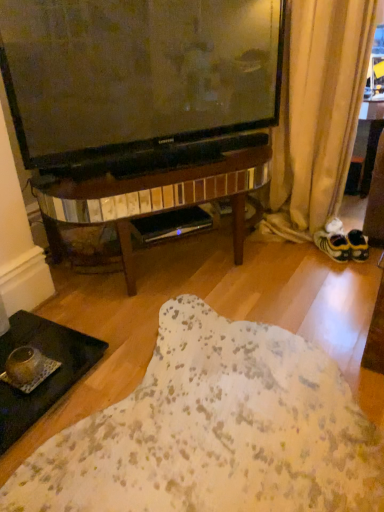
What is the approximate width of beige fabric curtain at lower right?

The width of beige fabric curtain at lower right is 13.13 inches.

Where is `yellow fabric shoe at right`? The image size is (384, 512). yellow fabric shoe at right is located at coordinates (333, 245).

The image size is (384, 512). What are the coordinates of `beige fabric curtain at lower right` in the screenshot? It's located at (317, 113).

Can you confirm if beige fabric curtain at lower right is thinner than black glass tray at lower left?

Indeed, beige fabric curtain at lower right has a lesser width compared to black glass tray at lower left.

Which point is more distant from viewer, (305, 191) or (39, 388)?

The point (305, 191) is farther.

Considering the sizes of beige fabric curtain at lower right and black glass tray at lower left in the image, is beige fabric curtain at lower right bigger or smaller than black glass tray at lower left?

In the image, beige fabric curtain at lower right appears to be larger than black glass tray at lower left.

Is beige fabric curtain at lower right facing away from black glass tray at lower left?

No, black glass tray at lower left is not at the back of beige fabric curtain at lower right.

Does beige fabric curtain at lower right have a larger size compared to yellow fabric shoe at right?

Correct, beige fabric curtain at lower right is larger in size than yellow fabric shoe at right.

Is beige fabric curtain at lower right closer to camera compared to yellow fabric shoe at right?

Yes, beige fabric curtain at lower right is in front of yellow fabric shoe at right.

Is point (318, 39) more distant than point (323, 236)?

No, (318, 39) is in front of (323, 236).

Looking at this image, is beige fabric curtain at lower right at the right side of yellow fabric shoe at right?

In fact, beige fabric curtain at lower right is to the left of yellow fabric shoe at right.

Is black glass tray at lower left located within yellow fabric shoe at right?

No, black glass tray at lower left is not a part of yellow fabric shoe at right.

Is yellow fabric shoe at right in contact with black glass tray at lower left?

They are not placed beside each other.

Between yellow fabric shoe at right and black glass tray at lower left, which one is positioned behind?

yellow fabric shoe at right is further from the camera.

Is the position of black glass tray at lower left more distant than that of beige fabric curtain at lower right?

That is False.

Is black glass tray at lower left outside of beige fabric curtain at lower right?

black glass tray at lower left is positioned outside beige fabric curtain at lower right.

Does black glass tray at lower left touch beige fabric curtain at lower right?

There is a gap between black glass tray at lower left and beige fabric curtain at lower right.

Looking at the image, does black glass tray at lower left seem bigger or smaller compared to beige fabric curtain at lower right?

Considering their sizes, black glass tray at lower left takes up less space than beige fabric curtain at lower right.

Considering the relative positions of black glass tray at lower left and yellow fabric shoe at right in the image provided, is black glass tray at lower left to the left of yellow fabric shoe at right from the viewer's perspective?

Indeed, black glass tray at lower left is positioned on the left side of yellow fabric shoe at right.

Who is more distant, black glass tray at lower left or yellow fabric shoe at right?

Positioned behind is yellow fabric shoe at right.

Considering the sizes of objects black glass tray at lower left and yellow fabric shoe at right in the image provided, who is taller, black glass tray at lower left or yellow fabric shoe at right?

yellow fabric shoe at right.

Consider the image. Looking at the image, does black glass tray at lower left seem bigger or smaller compared to yellow fabric shoe at right?

Considering their sizes, black glass tray at lower left takes up more space than yellow fabric shoe at right.

Where is `curtain above the yellow fabric shoe at right (from the image's perspective)`? The image size is (384, 512). curtain above the yellow fabric shoe at right (from the image's perspective) is located at coordinates (317, 113).

Is yellow fabric shoe at right next to beige fabric curtain at lower right and touching it?

yellow fabric shoe at right and beige fabric curtain at lower right are clearly separated.

Is point (328, 245) farther from camera compared to point (357, 94)?

Yes.

Is yellow fabric shoe at right bigger or smaller than beige fabric curtain at lower right?

yellow fabric shoe at right is smaller than beige fabric curtain at lower right.

You are a GUI agent. You are given a task and a screenshot of the screen. Output one action in this format:
    pyautogui.click(x=<x>, y=<y>)
    Task: Click on the coffee table located underneath the beige fabric curtain at lower right (from a real-world perspective)
    The height and width of the screenshot is (512, 384).
    Given the screenshot: What is the action you would take?
    pyautogui.click(x=48, y=377)

Where is `footwear that is below the beige fabric curtain at lower right (from the image's perspective)`? footwear that is below the beige fabric curtain at lower right (from the image's perspective) is located at coordinates (333, 245).

Estimate the real-world distances between objects in this image. Which object is further from beige fabric curtain at lower right, black glass tray at lower left or yellow fabric shoe at right?

Based on the image, black glass tray at lower left appears to be further to beige fabric curtain at lower right.

Based on their spatial positions, is yellow fabric shoe at right or black glass tray at lower left closer to beige fabric curtain at lower right?

yellow fabric shoe at right.

Based on their spatial positions, is beige fabric curtain at lower right or yellow fabric shoe at right closer to black glass tray at lower left?

The object closer to black glass tray at lower left is yellow fabric shoe at right.

From the image, which object appears to be farther from yellow fabric shoe at right, beige fabric curtain at lower right or black glass tray at lower left?

black glass tray at lower left is further to yellow fabric shoe at right.

Looking at the image, which one is located closer to black glass tray at lower left, yellow fabric shoe at right or beige fabric curtain at lower right?

yellow fabric shoe at right is closer to black glass tray at lower left.

Estimate the real-world distances between objects in this image. Which object is closer to yellow fabric shoe at right, black glass tray at lower left or beige fabric curtain at lower right?

Based on the image, beige fabric curtain at lower right appears to be nearer to yellow fabric shoe at right.

This screenshot has width=384, height=512. What are the coordinates of `curtain between black glass tray at lower left and yellow fabric shoe at right` in the screenshot? It's located at (317, 113).